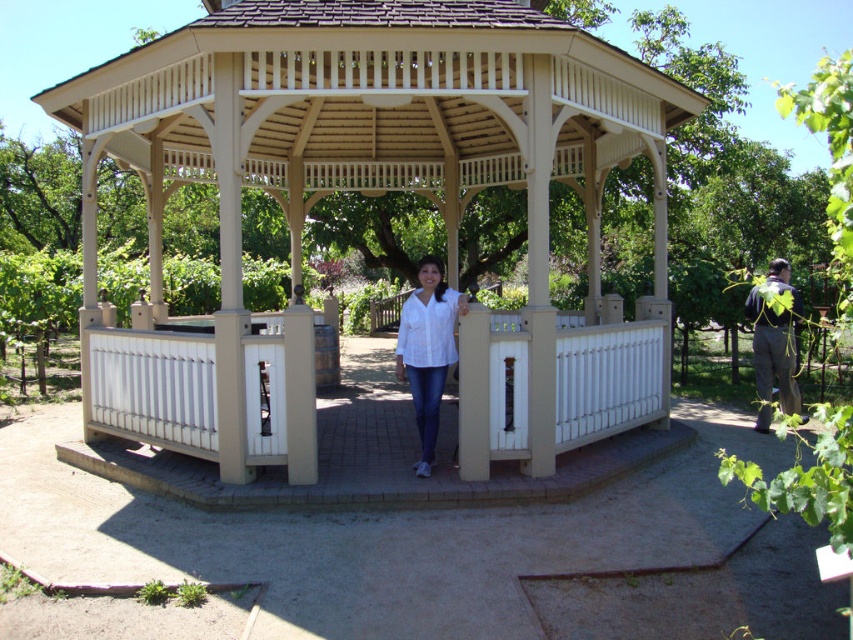
Is white matte shirt at center above gray fabric jacket at lower right?

No.

Does white matte shirt at center appear on the right side of gray fabric jacket at lower right?

In fact, white matte shirt at center is to the left of gray fabric jacket at lower right.

Where is `white matte shirt at center`? white matte shirt at center is located at coordinates (427, 349).

Who is positioned more to the right, beige wood gazebo at center or white matte shirt at center?

white matte shirt at center is more to the right.

Which is in front, point (488, 67) or point (422, 440)?

Point (488, 67) is more forward.

Which is in front, point (294, 138) or point (421, 332)?

Positioned in front is point (421, 332).

This screenshot has height=640, width=853. I want to click on beige wood gazebo at center, so click(375, 179).

Looking at this image, does beige wood gazebo at center have a lesser height compared to gray fabric jacket at lower right?

Yes.

Between point (556, 145) and point (762, 353), which one is positioned behind?

The point (556, 145) is more distant.

Where is `beige wood gazebo at center`? The width and height of the screenshot is (853, 640). beige wood gazebo at center is located at coordinates (375, 179).